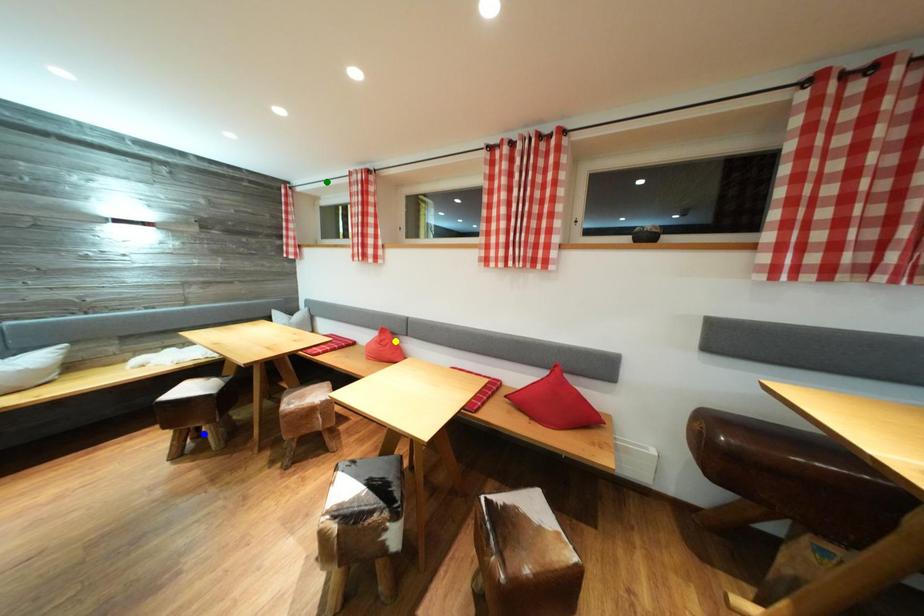
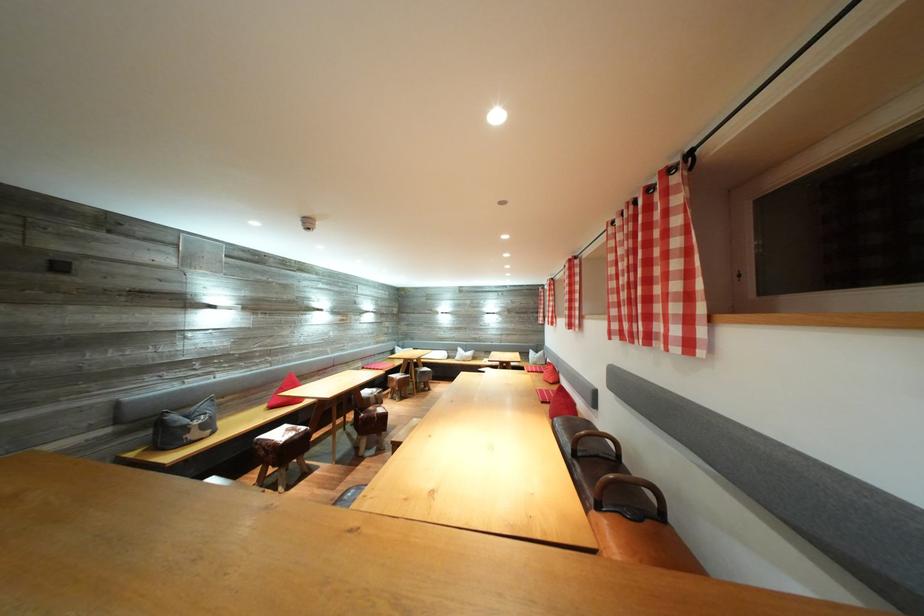
I am providing you with two images of the same scene from different viewpoints. Three points are marked in image1. Which point corresponds to a part or object that is occluded in image2?In image1, three points are marked. Which of them correspond to a part or object that is occluded in image2?Among the three points shown in image1, which one corresponds to a part or object that is no longer visible due to occlusion in image2?

Invisible in image2: blue point.